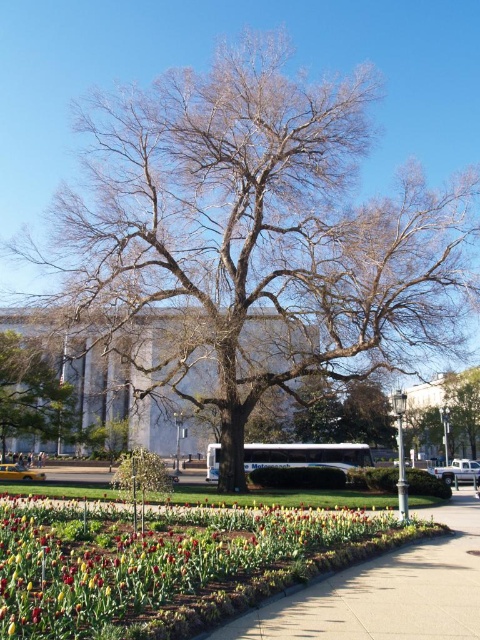
Looking at this image, can you confirm if bare wood tree at center is thinner than vivid multicolored tulips at center?

In fact, bare wood tree at center might be wider than vivid multicolored tulips at center.

Looking at this image, does bare wood tree at center appear over vivid multicolored tulips at center?

Correct, bare wood tree at center is located above vivid multicolored tulips at center.

Which is in front, point (284, 228) or point (131, 605)?

Point (131, 605) is more forward.

Identify the location of bare wood tree at center. Image resolution: width=480 pixels, height=640 pixels. (259, 225).

Does point (441, 298) come closer to viewer compared to point (6, 352)?

Yes.

In the scene shown: Is bare wood tree at center further to camera compared to green leafy tree at center?

→ No.

Which is in front, point (226, 216) or point (17, 435)?

Positioned in front is point (226, 216).

Locate an element on the screen. Image resolution: width=480 pixels, height=640 pixels. bare wood tree at center is located at coordinates (259, 225).

Is vivid multicolored tulips at center to the left of green leafy tree at center from the viewer's perspective?

No, vivid multicolored tulips at center is not to the left of green leafy tree at center.

Who is more distant from viewer, (15, 522) or (19, 413)?

The point (19, 413) is behind.

Locate an element on the screen. Image resolution: width=480 pixels, height=640 pixels. vivid multicolored tulips at center is located at coordinates (168, 563).